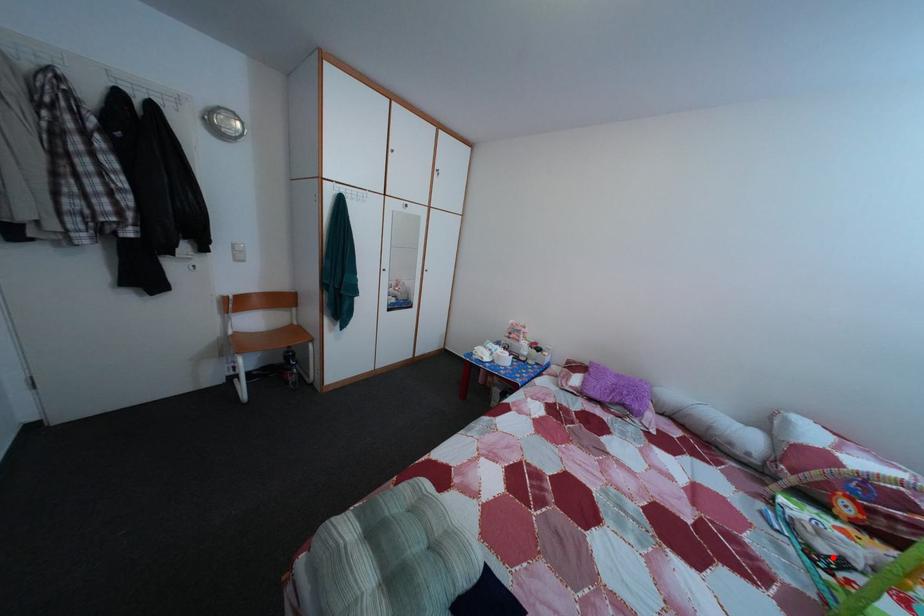
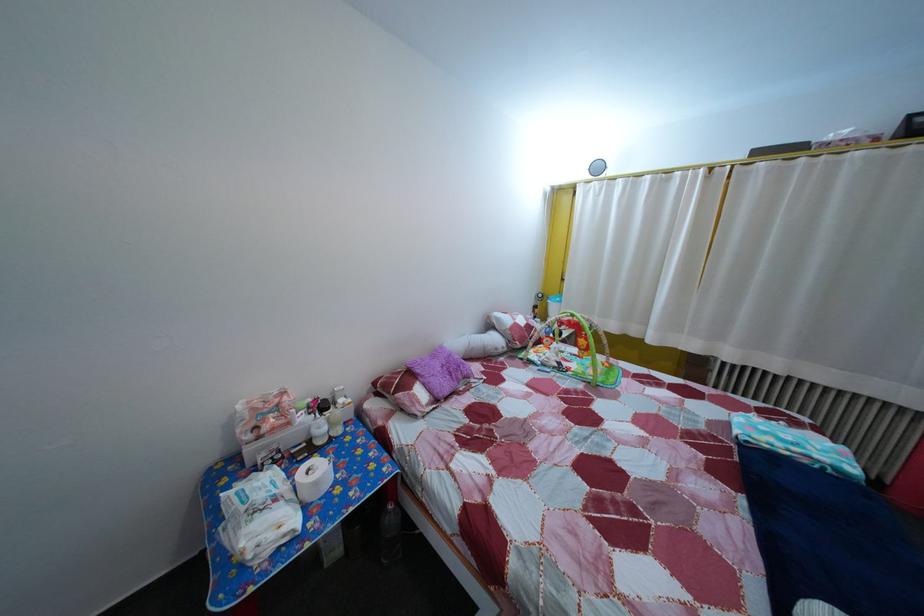
In the second image, find the point that corresponds to the highlighted location in the first image.

(565, 371)